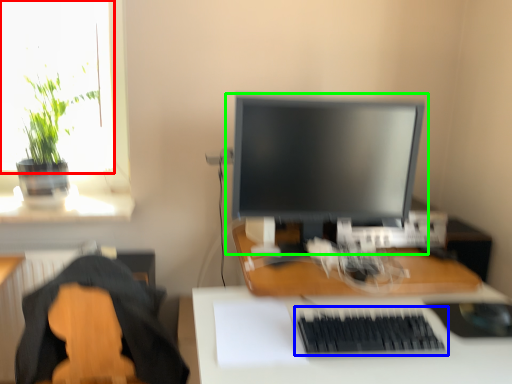
Question: Which object is positioned farthest from window screen (highlighted by a red box)? Select from computer keyboard (highlighted by a blue box) and computer monitor (highlighted by a green box).

Choices:
 (A) computer keyboard
 (B) computer monitor

Answer: (A)